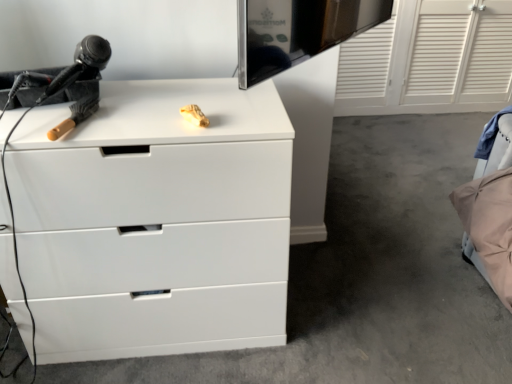
At what (x,y) coordinates should I click in order to perform the action: click on vacant area that is in front of black plastic hairdryer at left. Please return your answer as a coordinate pair (x, y). Image resolution: width=512 pixels, height=384 pixels. Looking at the image, I should click on (40, 121).